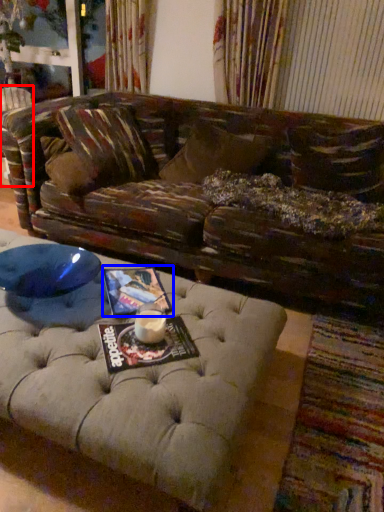
Question: Which point is closer to the camera, swivel chair (highlighted by a red box) or magazine (highlighted by a blue box)?

Choices:
 (A) swivel chair
 (B) magazine

Answer: (B)